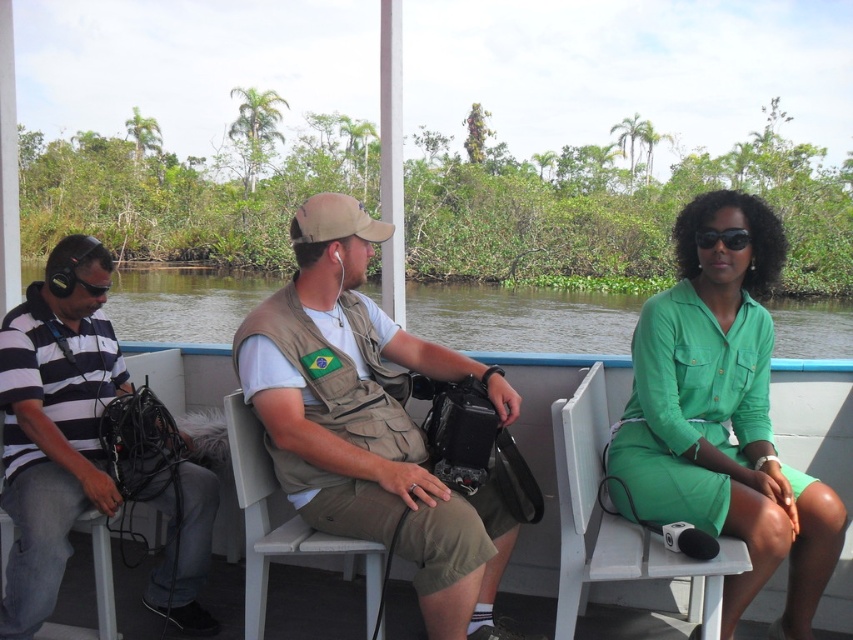
Is tan fabric vest at center thinner than striped cotton shirt at left?

Incorrect, tan fabric vest at center's width is not less than striped cotton shirt at left's.

Which is behind, point (256, 388) or point (82, 454)?

Positioned behind is point (82, 454).

The width and height of the screenshot is (853, 640). Identify the location of tan fabric vest at center. (369, 420).

Is point (596, 435) positioned before point (260, 627)?

No, (596, 435) is behind (260, 627).

The image size is (853, 640). Identify the location of green fabric chair at right. (616, 516).

Is white plastic chair at center to the right of black matte sunglasses at center from the viewer's perspective?

In fact, white plastic chair at center is to the left of black matte sunglasses at center.

Is point (260, 560) closer to viewer compared to point (741, 243)?

No, it is not.

Locate an element on the screen. The height and width of the screenshot is (640, 853). white plastic chair at center is located at coordinates (281, 524).